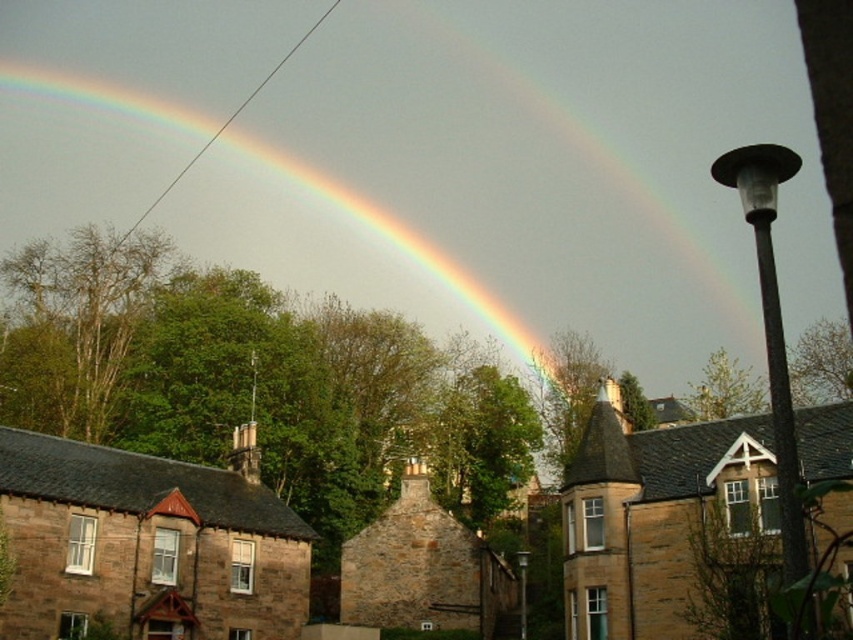
Measure the distance from rainbow at upper center to brown stone house at lower left.

The distance of rainbow at upper center from brown stone house at lower left is 113.61 meters.

In order to click on rainbow at upper center in this screenshot , I will do `click(325, 241)`.

Who is more forward, (x=231, y=205) or (x=123, y=608)?

Point (x=123, y=608) is in front.

I want to click on rainbow at upper center, so click(x=325, y=241).